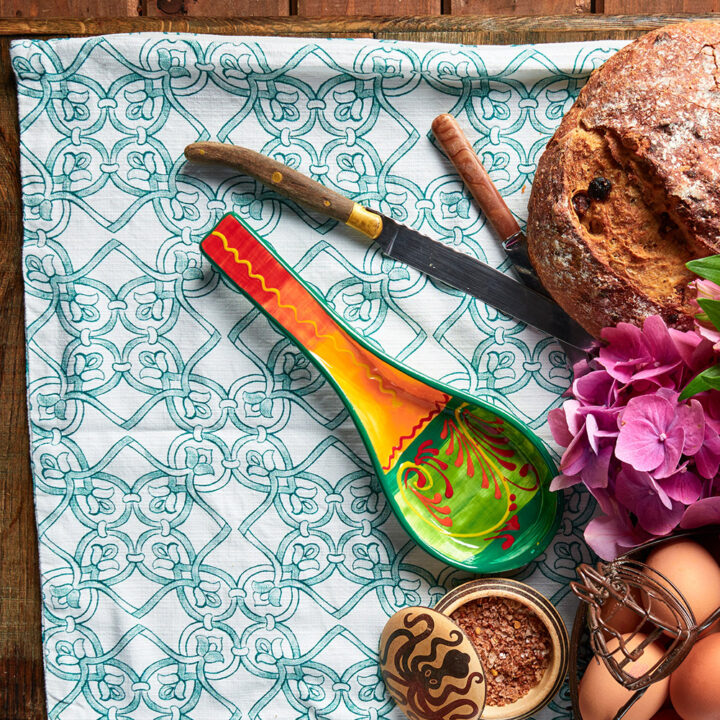
The width and height of the screenshot is (720, 720). Find the location of `handle of spoon rest`. handle of spoon rest is located at coordinates (307, 322).